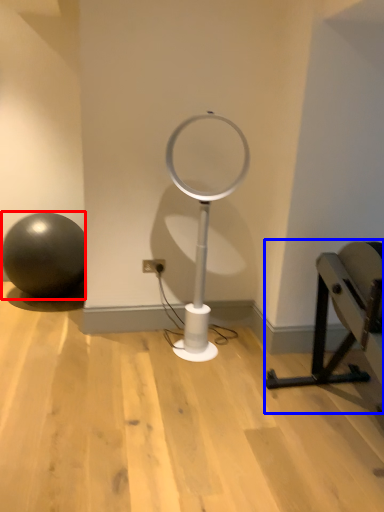
Question: Which of the following is the closest to the observer, ball (highlighted by a red box) or furniture (highlighted by a blue box)?

Choices:
 (A) ball
 (B) furniture

Answer: (B)